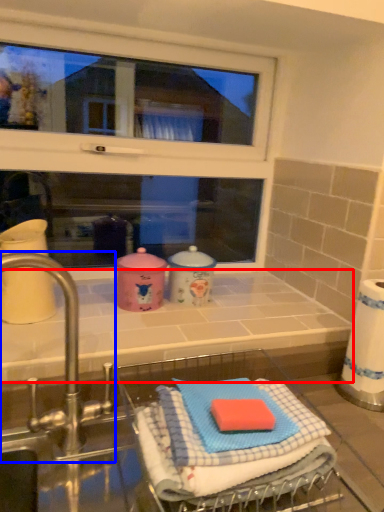
Question: Among these objects, which one is nearest to the camera, counter top (highlighted by a red box) or tap (highlighted by a blue box)?

Choices:
 (A) counter top
 (B) tap

Answer: (B)